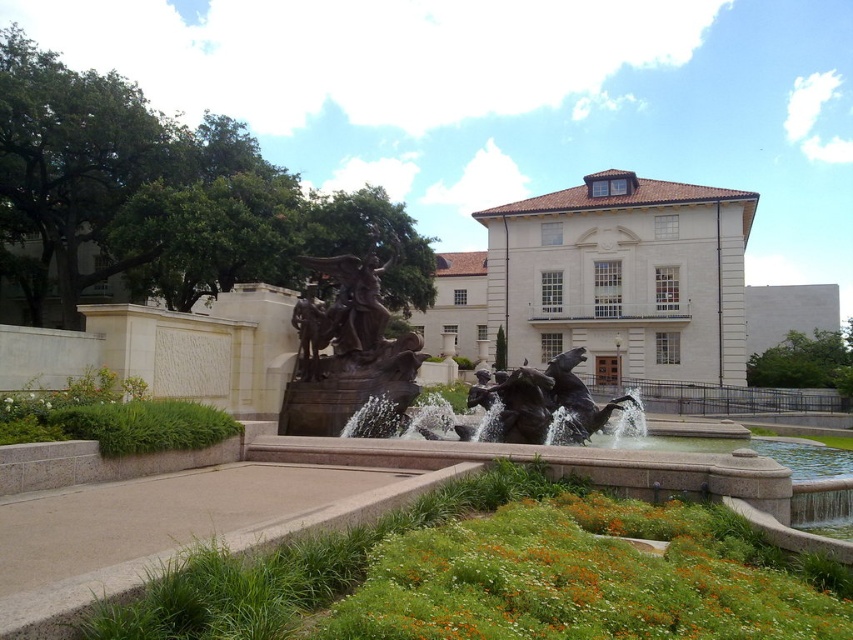
Who is taller, white stone palace at center or bronze/statue at center?

With more height is white stone palace at center.

Between point (647, 296) and point (283, 394), which one is positioned in front?

Point (283, 394) is more forward.

Identify the location of white stone palace at center. The width and height of the screenshot is (853, 640). (633, 296).

In the scene shown: Can you confirm if green grass at lower center is positioned to the right of white stone palace at center?

In fact, green grass at lower center is to the left of white stone palace at center.

Locate an element on the screen. Image resolution: width=853 pixels, height=640 pixels. green grass at lower center is located at coordinates (494, 573).

You are a GUI agent. You are given a task and a screenshot of the screen. Output one action in this format:
    pyautogui.click(x=<x>, y=<y>)
    Task: Click on the green grass at lower center
    
    Given the screenshot: What is the action you would take?
    pyautogui.click(x=494, y=573)

Between point (332, 362) and point (560, 401), which one is positioned behind?

Point (332, 362)

Is bronze/statue at center shorter than bronze/rough textured horse at center?

In fact, bronze/statue at center may be taller than bronze/rough textured horse at center.

Is point (378, 390) positioned after point (535, 404)?

Yes.

The height and width of the screenshot is (640, 853). Find the location of `bronze/statue at center`. bronze/statue at center is located at coordinates (347, 349).